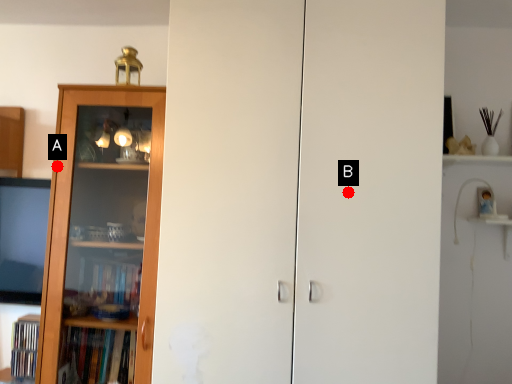
Question: Two points are circled on the image, labeled by A and B beside each circle. Among these points, which one is nearest to the camera?

Choices:
 (A) A is closer
 (B) B is closer

Answer: (B)